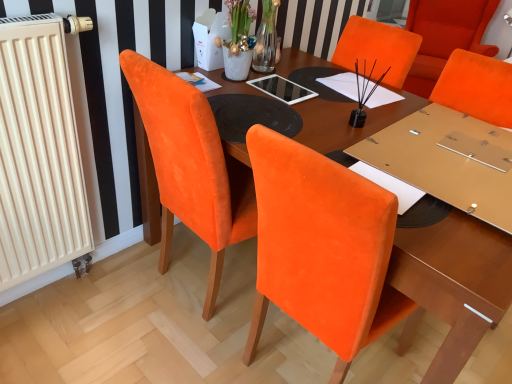
Where is `velvet orange chair at upper right`? velvet orange chair at upper right is located at coordinates (445, 36).

This screenshot has width=512, height=384. What do you see at coordinates (456, 282) in the screenshot?
I see `wooden table at center` at bounding box center [456, 282].

Find the location of `velvet orange chair at upper right`. velvet orange chair at upper right is located at coordinates (445, 36).

Is wooden table at center facing away from beige radiator at left?

No, wooden table at center's orientation is not away from beige radiator at left.

From the image's perspective, is wooden table at center on top of beige radiator at left?

Actually, wooden table at center appears below beige radiator at left in the image.

You are a GUI agent. You are given a task and a screenshot of the screen. Output one action in this format:
    pyautogui.click(x=<x>, y=<y>)
    Task: Click on the table on the right of the beige radiator at left
    The height and width of the screenshot is (384, 512).
    Given the screenshot: What is the action you would take?
    pyautogui.click(x=456, y=282)

Does wooden table at center have a smaller size compared to beige radiator at left?

Actually, wooden table at center might be larger than beige radiator at left.

Does beige radiator at left have a lesser height compared to wooden table at center?

In fact, beige radiator at left may be taller than wooden table at center.

From a real-world perspective, does beige radiator at left stand above wooden table at center?

Indeed, from a real-world perspective, beige radiator at left stands above wooden table at center.

Does beige radiator at left contain wooden table at center?

No, wooden table at center is not a part of beige radiator at left.

I want to click on radiator located on the left of velvet orange chair at upper right, so click(x=39, y=154).

Measure the distance from beige radiator at left to velvet orange chair at upper right.

The distance of beige radiator at left from velvet orange chair at upper right is 2.63 meters.

Is beige radiator at left beside velvet orange chair at upper right?

No, beige radiator at left is not touching velvet orange chair at upper right.

From a real-world perspective, relative to velvet orange chair at upper right, is beige radiator at left vertically above or below?

beige radiator at left is situated higher than velvet orange chair at upper right in the real world.

In the scene shown: From the image's perspective, which is above, wooden table at center or velvet orange chair at upper right?

velvet orange chair at upper right appears higher in the image.

Based on the photo, between wooden table at center and velvet orange chair at upper right, which one is positioned in front?

wooden table at center.

Considering the sizes of objects wooden table at center and velvet orange chair at upper right in the image provided, who is shorter, wooden table at center or velvet orange chair at upper right?

wooden table at center.

Where is `chair above the wooden table at center (from the image's perspective)`? The width and height of the screenshot is (512, 384). chair above the wooden table at center (from the image's perspective) is located at coordinates click(x=445, y=36).

Is velvet orange chair at upper right turned away from wooden table at center?

velvet orange chair at upper right is not turned away from wooden table at center.

Is point (452, 21) more distant than point (451, 360)?

Yes, point (452, 21) is farther from viewer.

Who is taller, velvet orange chair at upper right or wooden table at center?

velvet orange chair at upper right is taller.

Would you say velvet orange chair at upper right is to the left or to the right of wooden table at center in the picture?

Based on their positions, velvet orange chair at upper right is located to the right of wooden table at center.

Is velvet orange chair at upper right beside beige radiator at left?

velvet orange chair at upper right and beige radiator at left are clearly separated.

From the image's perspective, which one is positioned higher, velvet orange chair at upper right or beige radiator at left?

From the image's view, velvet orange chair at upper right is above.

Between velvet orange chair at upper right and beige radiator at left, which one appears on the right side from the viewer's perspective?

Positioned to the right is velvet orange chair at upper right.

Looking at this image, is velvet orange chair at upper right positioned beyond the bounds of beige radiator at left?

Yes.

You are a GUI agent. You are given a task and a screenshot of the screen. Output one action in this format:
    pyautogui.click(x=<x>, y=<y>)
    Task: Click on the radiator above the wooden table at center (from a real-world perspective)
    The width and height of the screenshot is (512, 384).
    Given the screenshot: What is the action you would take?
    pyautogui.click(x=39, y=154)

At what (x,y) coordinates should I click in order to perform the action: click on table on the right of beige radiator at left. Please return your answer as a coordinate pair (x, y). The width and height of the screenshot is (512, 384). Looking at the image, I should click on click(x=456, y=282).

When comparing their distances from wooden table at center, does velvet orange chair at upper right or beige radiator at left seem closer?

beige radiator at left is positioned closer to the anchor wooden table at center.

Estimate the real-world distances between objects in this image. Which object is closer to beige radiator at left, velvet orange chair at upper right or wooden table at center?

The object closer to beige radiator at left is wooden table at center.

Estimate the real-world distances between objects in this image. Which object is closer to wooden table at center, beige radiator at left or velvet orange chair at upper right?

beige radiator at left is closer to wooden table at center.

When comparing their distances from velvet orange chair at upper right, does wooden table at center or beige radiator at left seem further?

beige radiator at left.

When comparing their distances from velvet orange chair at upper right, does beige radiator at left or wooden table at center seem further?

Based on the image, beige radiator at left appears to be further to velvet orange chair at upper right.

Considering their positions, is wooden table at center positioned closer to beige radiator at left than velvet orange chair at upper right?

wooden table at center lies closer to beige radiator at left than the other object.

I want to click on radiator between wooden table at center and velvet orange chair at upper right along the z-axis, so click(x=39, y=154).